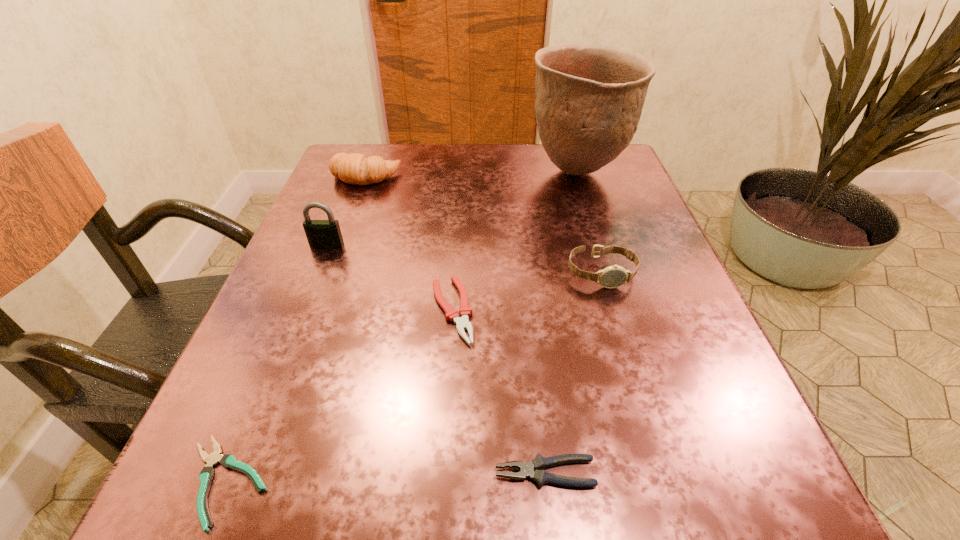
Where is `crescent roll that is positioned at the far edge`? The image size is (960, 540). crescent roll that is positioned at the far edge is located at coordinates (355, 168).

At what (x,y) coordinates should I click in order to perform the action: click on padlock that is at the left edge. Please return your answer as a coordinate pair (x, y). This screenshot has height=540, width=960. Looking at the image, I should click on (321, 234).

Image resolution: width=960 pixels, height=540 pixels. What are the coordinates of `crescent roll that is at the left edge` in the screenshot? It's located at (355, 168).

You are a GUI agent. You are given a task and a screenshot of the screen. Output one action in this format:
    pyautogui.click(x=<x>, y=<y>)
    Task: Click on the pliers located at the left edge
    The width and height of the screenshot is (960, 540).
    Given the screenshot: What is the action you would take?
    pyautogui.click(x=229, y=461)

The width and height of the screenshot is (960, 540). What are the coordinates of `pottery that is at the right edge` in the screenshot? It's located at (589, 98).

The width and height of the screenshot is (960, 540). In order to click on watch at the right edge in this screenshot , I will do `click(615, 276)`.

Image resolution: width=960 pixels, height=540 pixels. I want to click on object present at the far left corner, so click(x=355, y=168).

The width and height of the screenshot is (960, 540). What are the coordinates of `object that is at the near left corner` in the screenshot? It's located at (229, 461).

Where is `object located at the far right corner`? object located at the far right corner is located at coordinates (589, 98).

Where is `free location at the far edge`? This screenshot has width=960, height=540. free location at the far edge is located at coordinates (419, 190).